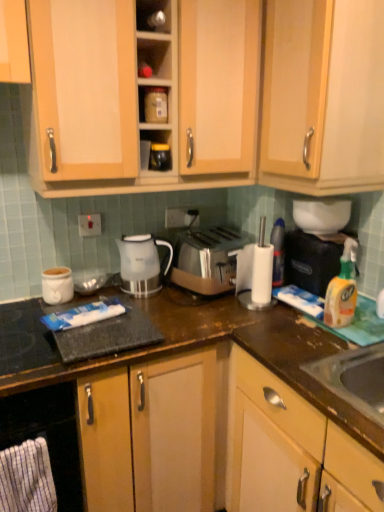
Question: Is white plastic blender at center positioned far away from white plastic paper towel holder at right?

Choices:
 (A) no
 (B) yes

Answer: (A)

Question: Is white plastic blender at center wider than white plastic paper towel holder at right?

Choices:
 (A) no
 (B) yes

Answer: (B)

Question: From the image's perspective, would you say white plastic blender at center is shown under white plastic paper towel holder at right?

Choices:
 (A) yes
 (B) no

Answer: (A)

Question: Considering the relative sizes of white plastic blender at center and white plastic paper towel holder at right in the image provided, is white plastic blender at center thinner than white plastic paper towel holder at right?

Choices:
 (A) no
 (B) yes

Answer: (A)

Question: From the image's perspective, does white plastic blender at center appear higher than white plastic paper towel holder at right?

Choices:
 (A) yes
 (B) no

Answer: (B)

Question: In terms of height, does white plastic paper towel holder at right look taller or shorter compared to white plastic electric outlet at upper center, the second electric outlet positioned from the right?

Choices:
 (A) short
 (B) tall

Answer: (B)

Question: Is white plastic paper towel holder at right inside or outside of white plastic electric outlet at upper center, the first electric outlet positioned from the left?

Choices:
 (A) outside
 (B) inside

Answer: (A)

Question: In the image, is white plastic paper towel holder at right positioned in front of or behind white plastic electric outlet at upper center, the 1th electric outlet in the front-to-back sequence?

Choices:
 (A) front
 (B) behind

Answer: (A)

Question: Is white plastic paper towel holder at right wider or thinner than white plastic electric outlet at upper center, acting as the second electric outlet starting from the back?

Choices:
 (A) thin
 (B) wide

Answer: (B)

Question: Is point (306, 272) closer or farther from the camera than point (360, 106)?

Choices:
 (A) farther
 (B) closer

Answer: (A)

Question: Considering the positions of translucent plastic spray bottle at right, the 1th appliance positioned from the right, and wooden cabinet at upper center, the 1th cabinetry viewed from the top, in the image, is translucent plastic spray bottle at right, the 1th appliance positioned from the right, wider or thinner than wooden cabinet at upper center, the 1th cabinetry viewed from the top,?

Choices:
 (A) thin
 (B) wide

Answer: (A)

Question: From the image's perspective, is translucent plastic spray bottle at right, the 1th appliance positioned from the right, above or below wooden cabinet at upper center, placed as the 3th cabinetry when sorted from bottom to top?

Choices:
 (A) below
 (B) above

Answer: (A)

Question: Considering the positions of translucent plastic spray bottle at right, the 1th appliance positioned from the right, and wooden cabinet at upper center, placed as the 3th cabinetry when sorted from bottom to top, in the image, is translucent plastic spray bottle at right, the 1th appliance positioned from the right, bigger or smaller than wooden cabinet at upper center, placed as the 3th cabinetry when sorted from bottom to top,?

Choices:
 (A) big
 (B) small

Answer: (B)

Question: Based on their sizes in the image, would you say metallic silver container at upper center, which is the 2th shelf in bottom-to-top order, is bigger or smaller than wooden cabinet at upper center, placed as the 3th cabinetry when sorted from bottom to top?

Choices:
 (A) big
 (B) small

Answer: (B)

Question: Considering the positions of metallic silver container at upper center, which is the 2th shelf in bottom-to-top order, and wooden cabinet at upper center, the 1th cabinetry viewed from the top, in the image, is metallic silver container at upper center, which is the 2th shelf in bottom-to-top order, wider or thinner than wooden cabinet at upper center, the 1th cabinetry viewed from the top,?

Choices:
 (A) thin
 (B) wide

Answer: (A)